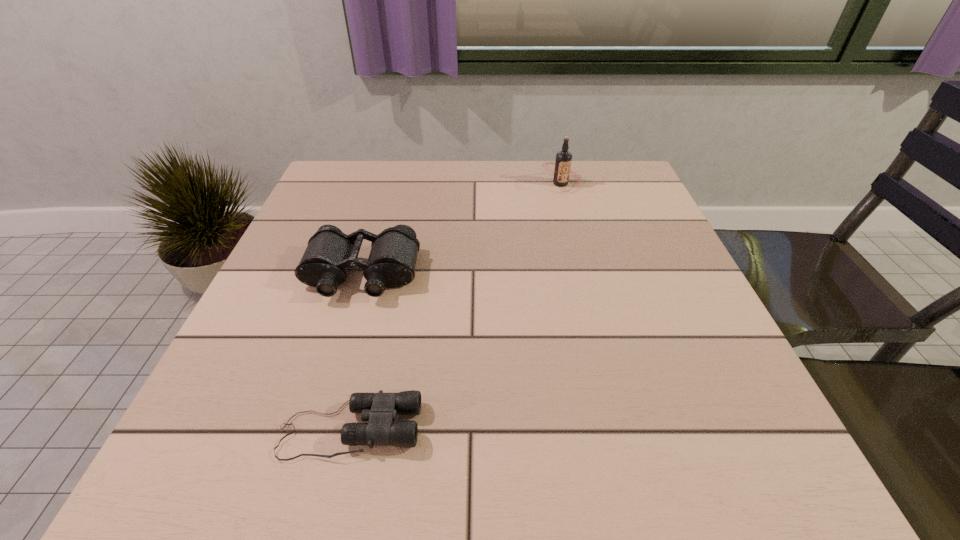
You are a GUI agent. You are given a task and a screenshot of the screen. Output one action in this format:
    pyautogui.click(x=<x>, y=<y>)
    Task: Click on the object situated at the near edge
    The width and height of the screenshot is (960, 540).
    Given the screenshot: What is the action you would take?
    [x=380, y=409]

Locate an element on the screen. This screenshot has width=960, height=540. object that is at the right edge is located at coordinates (562, 171).

Where is `object that is at the near left corner`? The width and height of the screenshot is (960, 540). object that is at the near left corner is located at coordinates (380, 409).

I want to click on object present at the far right corner, so click(562, 171).

This screenshot has height=540, width=960. I want to click on vacant space at the far edge, so click(x=448, y=165).

In the image, there is a desktop. Identify the location of vacant space at the near edge. (626, 430).

Where is `blank area at the left edge`? blank area at the left edge is located at coordinates (225, 418).

Locate an element on the screen. free space at the right edge of the desktop is located at coordinates (642, 338).

Where is `vacant space at the far left corner of the desktop`? vacant space at the far left corner of the desktop is located at coordinates (353, 168).

The height and width of the screenshot is (540, 960). In the image, there is a desktop. Find the location of `free space at the far right corner`. free space at the far right corner is located at coordinates (628, 185).